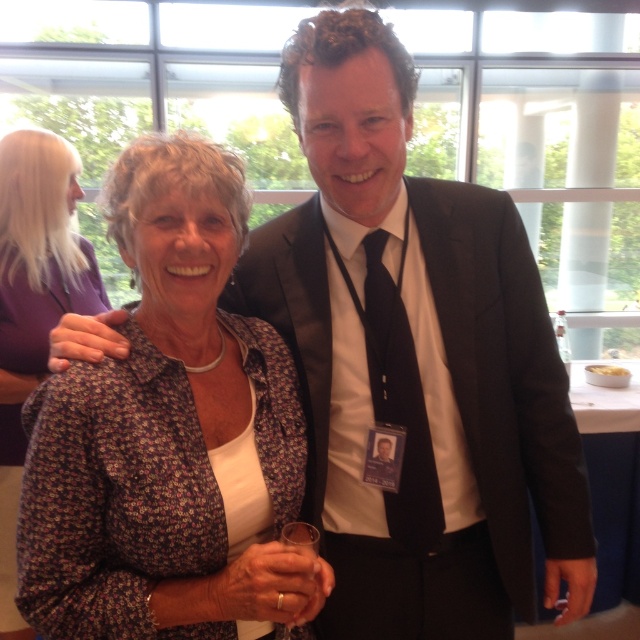
Who is positioned more to the left, black smooth suit at center or floral fabric blouse at center?

From the viewer's perspective, floral fabric blouse at center appears more on the left side.

Consider the image. Can you confirm if black smooth suit at center is positioned below floral fabric blouse at center?

Yes.

Image resolution: width=640 pixels, height=640 pixels. What are the coordinates of `black smooth suit at center` in the screenshot? It's located at (504, 376).

Is black smooth suit at center smaller than black silk tie at center?

No.

Looking at this image, which is more to the left, black smooth suit at center or black silk tie at center?

Positioned to the left is black silk tie at center.

Is point (516, 314) positioned after point (412, 509)?

That is True.

Locate an element on the screen. This screenshot has width=640, height=640. black smooth suit at center is located at coordinates (504, 376).

Is point (227, 404) more distant than point (49, 236)?

No, (227, 404) is closer to viewer.

Looking at this image, does floral-patterned jacket at center appear on the left side of floral fabric blouse at center?

In fact, floral-patterned jacket at center is to the right of floral fabric blouse at center.

Is point (172, 163) positioned in front of point (20, 369)?

Yes, it is.

Locate an element on the screen. This screenshot has height=640, width=640. floral-patterned jacket at center is located at coordinates (170, 435).